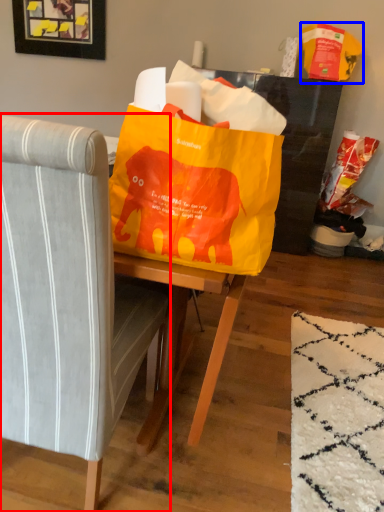
Question: Which point is further to the camera, chair (highlighted by a red box) or grocery bag (highlighted by a blue box)?

Choices:
 (A) chair
 (B) grocery bag

Answer: (B)